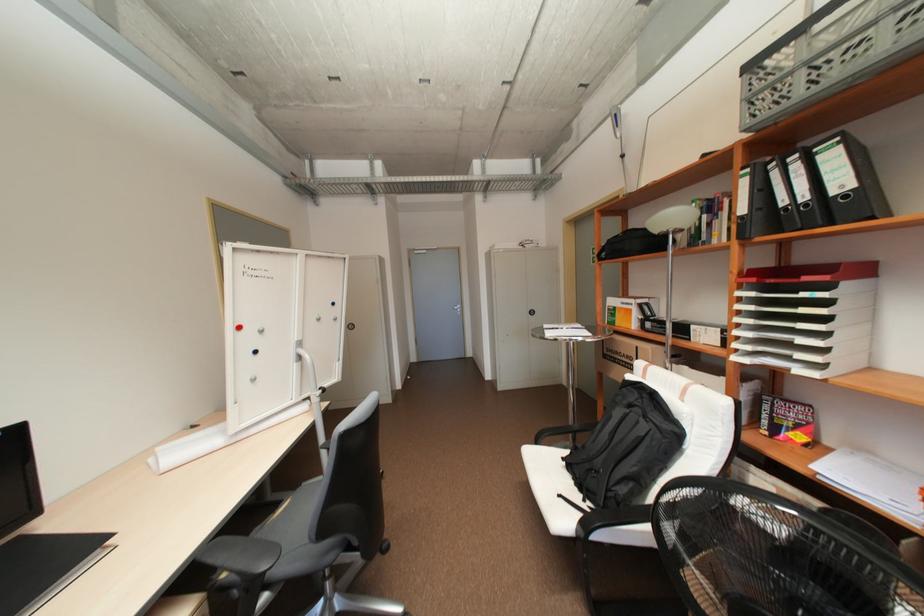
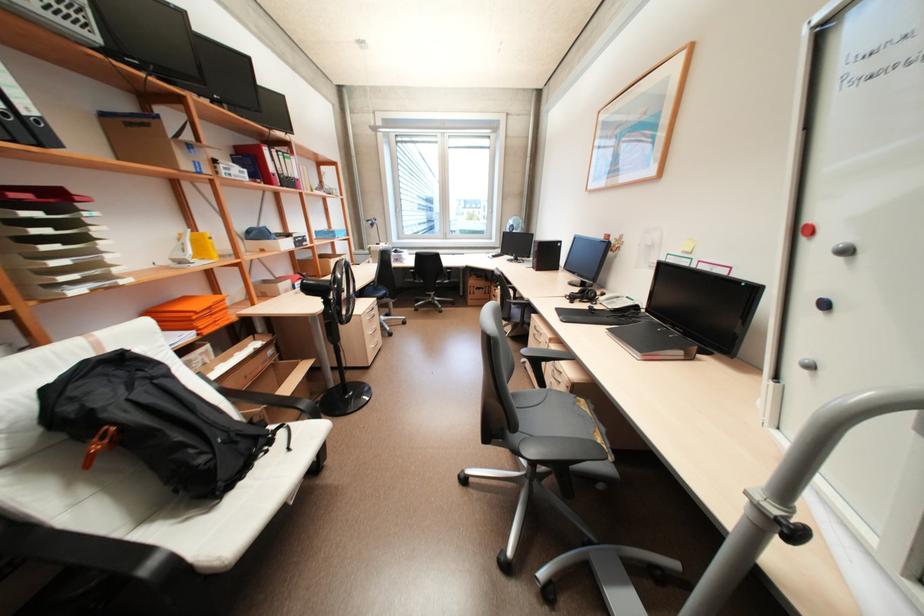
Where in the second image is the point corresponding to pixel 837 224 from the first image?

(46, 146)